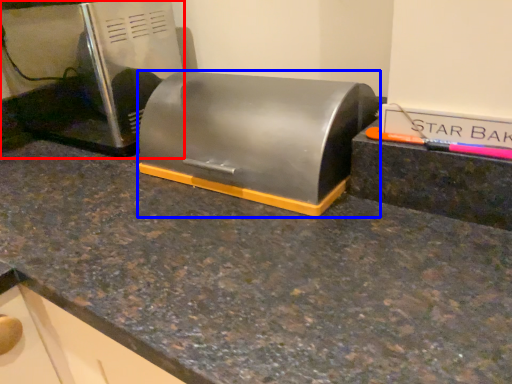
Question: Which object is further to the camera taking this photo, home appliance (highlighted by a red box) or appliance (highlighted by a blue box)?

Choices:
 (A) home appliance
 (B) appliance

Answer: (A)